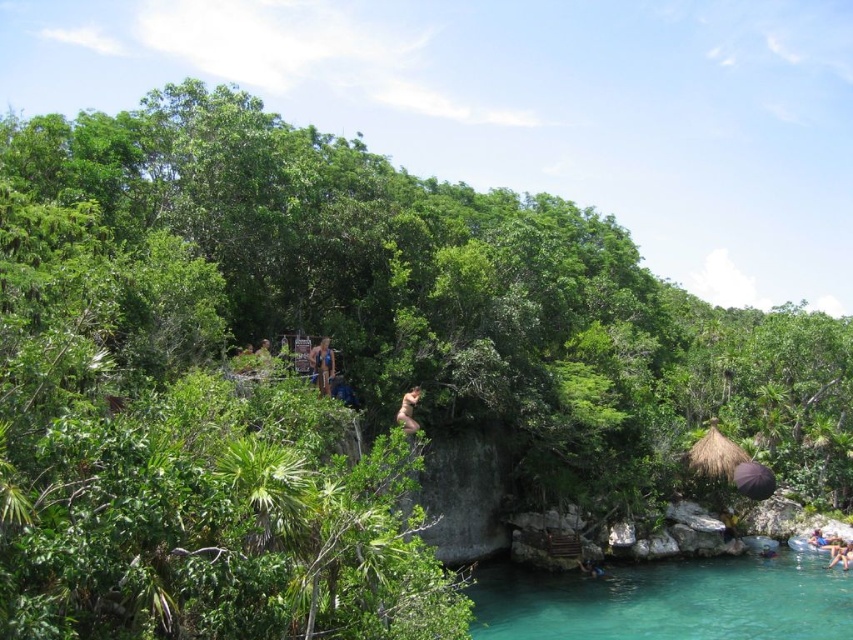
You are a photographer standing at the point with coordinates point (408,410). You want to capture a photo of the nude human at center. Based on your position, will you be able to see the entire nude human at center in your shot?

The point (408,410) is on the nude human at center, so you are positioned directly on the nude human at center. This means you won t be able to see the entire nude human at center in your shot because you are located on the subject itself.

You are planning to take a photo of the tan skin person at center and the brown leather backpack at lower right. Which object should you focus on first to ensure both are in sharp focus?

You should focus on the tan skin person at center first because it is closer to you than the brown leather backpack at lower right, so focusing on the closer object ensures both will be in focus when using depth of field properly.